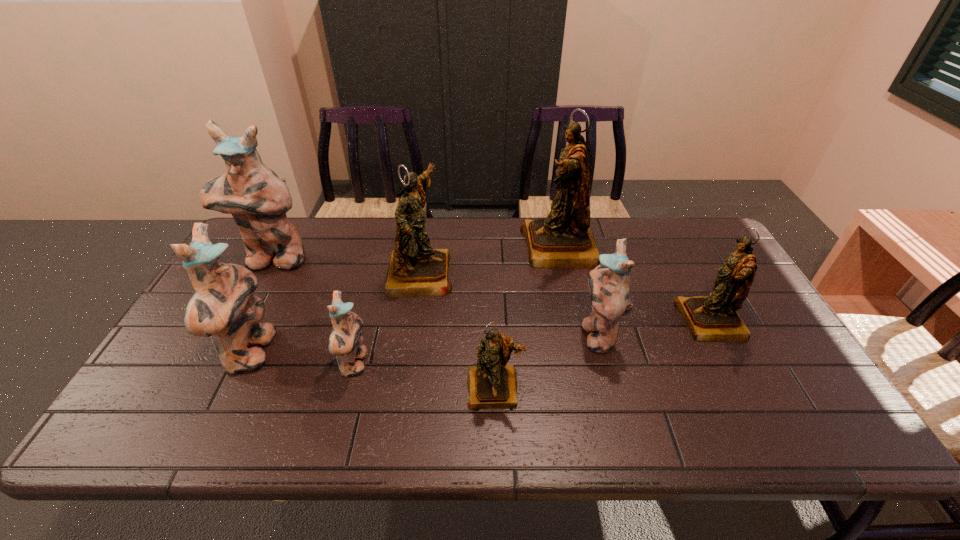
The image size is (960, 540). What are the coordinates of `the farthest pink figurine` in the screenshot? It's located at (257, 198).

Identify the location of the biggest gold figurine. This screenshot has height=540, width=960. (564, 239).

Find the location of a particular element. The image size is (960, 540). the third smallest gold figurine is located at coordinates (415, 269).

The width and height of the screenshot is (960, 540). Identify the location of the third smallest pink figurine. (223, 307).

This screenshot has height=540, width=960. Identify the location of the rightmost object. (709, 318).

Find the location of a particular element. This screenshot has height=540, width=960. the rightmost gold figurine is located at coordinates (709, 318).

Where is `the rightmost pink figurine`? The image size is (960, 540). the rightmost pink figurine is located at coordinates (608, 283).

This screenshot has height=540, width=960. Identify the location of the second pink figurine from right to left. (346, 338).

Identify the location of the smallest gold figurine. (492, 383).

Find the location of a particular element. the fourth object from right to left is located at coordinates (492, 383).